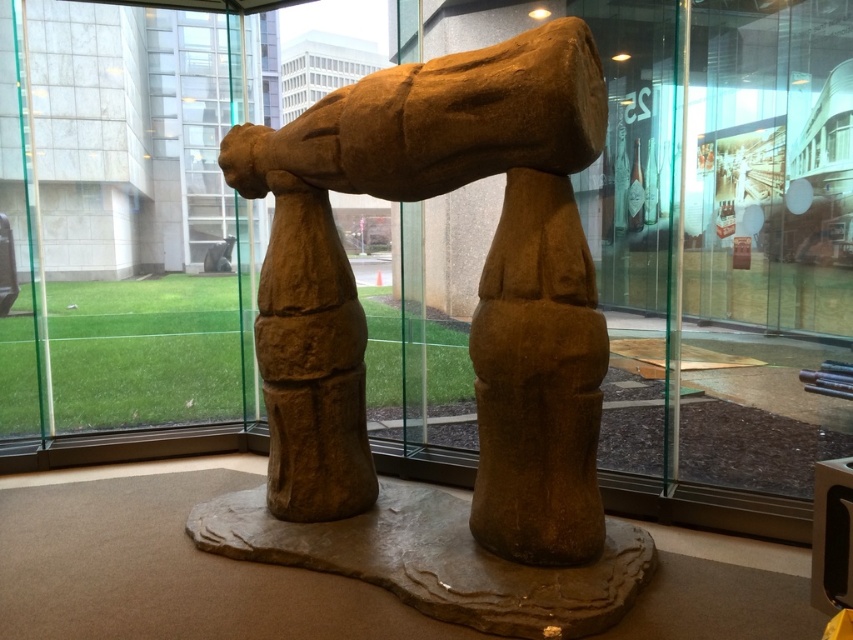
Can you confirm if brown stone sculpture at center is taller than transparent glass door at upper left?

No, brown stone sculpture at center is not taller than transparent glass door at upper left.

Is brown stone sculpture at center to the left of transparent glass door at upper left from the viewer's perspective?

In fact, brown stone sculpture at center is to the right of transparent glass door at upper left.

Is point (258, 516) farther from camera compared to point (13, 122)?

No, (258, 516) is in front of (13, 122).

Where is `brown stone sculpture at center`? This screenshot has height=640, width=853. brown stone sculpture at center is located at coordinates (469, 342).